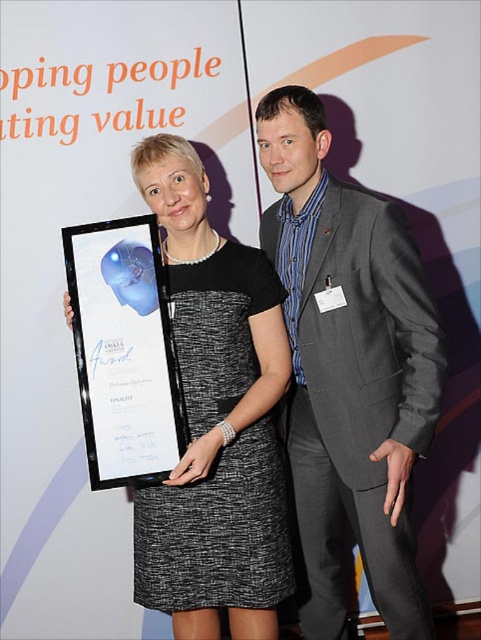
Question: Is gray wool suit at center behind white glossy plaque at center?

Choices:
 (A) no
 (B) yes

Answer: (B)

Question: Can you confirm if gray wool suit at center is positioned to the left of white glossy plaque at center?

Choices:
 (A) yes
 (B) no

Answer: (B)

Question: Which point is farther from the camera taking this photo?

Choices:
 (A) (393, 438)
 (B) (212, 432)

Answer: (A)

Question: Among these objects, which one is farthest from the camera?

Choices:
 (A) black textured dress at center
 (B) white glossy plaque at center
 (C) gray wool suit at center

Answer: (C)

Question: Which point is farther to the camera?

Choices:
 (A) white glossy plaque at center
 (B) gray wool suit at center
 (C) black textured dress at center

Answer: (B)

Question: Is black textured dress at center above white glossy plaque at center?

Choices:
 (A) no
 (B) yes

Answer: (A)